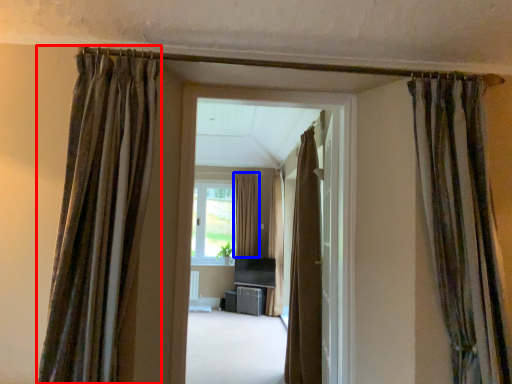
Question: Which point is further to the camera, curtain (highlighted by a red box) or curtain (highlighted by a blue box)?

Choices:
 (A) curtain
 (B) curtain

Answer: (B)